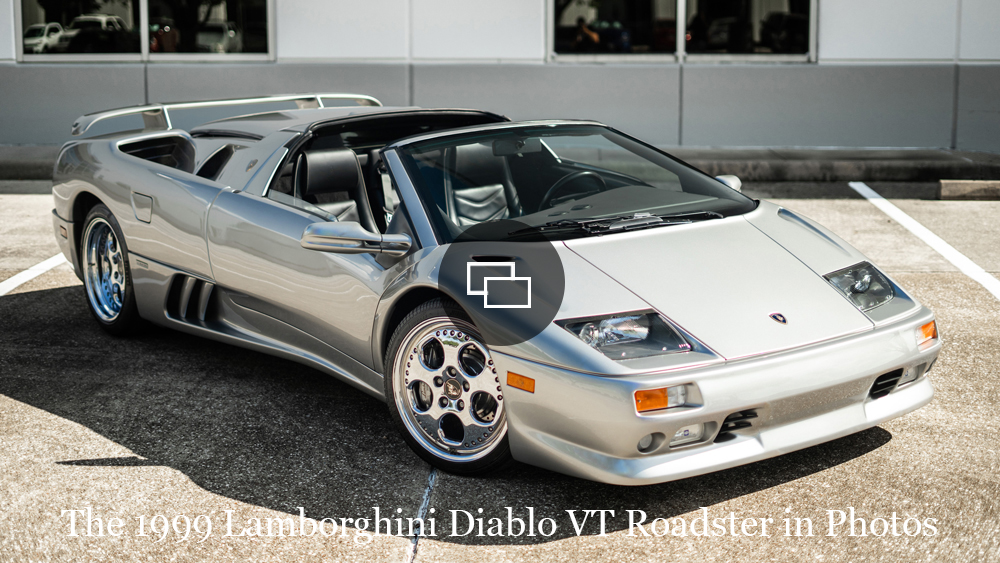
At what (x,y) coordinates should I click in order to perform the action: click on light. Please return your answer as a coordinate pair (x, y). This screenshot has width=1000, height=563. Looking at the image, I should click on (624, 329).